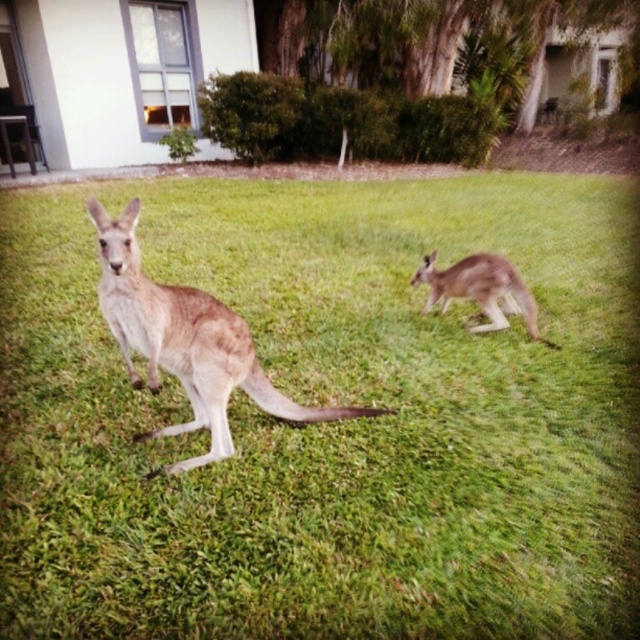
From the picture: Who is more forward, (140, 307) or (440, 280)?

Point (140, 307)

Who is more distant from viewer, (93, 212) or (499, 310)?

Point (499, 310)

This screenshot has width=640, height=640. I want to click on light brown fur kangaroo at center, so click(x=186, y=342).

Identify the location of light brown fur kangaroo at center. (186, 342).

Who is higher up, brown fur kangaroo at center or light brown fur kangaroo at center?

brown fur kangaroo at center is above.

Between point (429, 369) and point (237, 321), which one is positioned behind?

Point (429, 369)

Describe the element at coordinates (328, 422) in the screenshot. I see `brown fur kangaroo at center` at that location.

This screenshot has width=640, height=640. I want to click on brown fur kangaroo at center, so click(x=328, y=422).

Which is in front, point (595, 289) or point (474, 259)?

Positioned in front is point (474, 259).

This screenshot has width=640, height=640. Identify the location of brown fur kangaroo at center. (328, 422).

Image resolution: width=640 pixels, height=640 pixels. In order to click on brown fur kangaroo at center in this screenshot , I will do `click(328, 422)`.